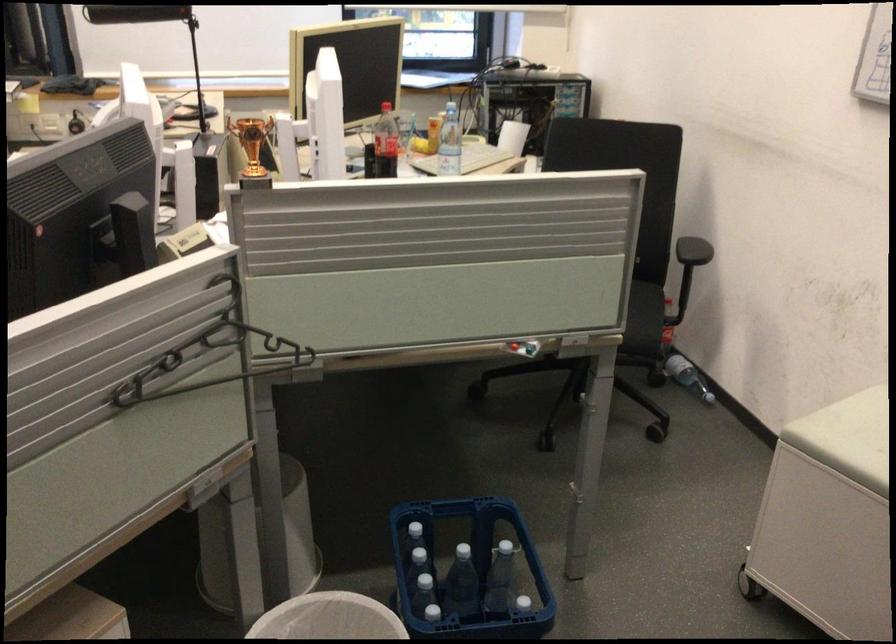
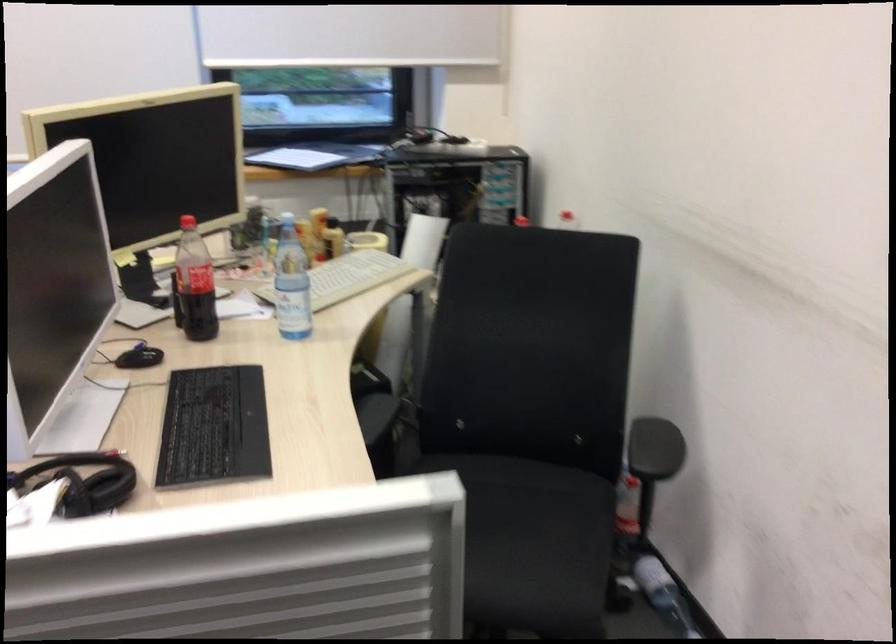
In the scene shown: What movement of the cameraman would produce the second image?

The movement direction of the cameraman is right, forward.